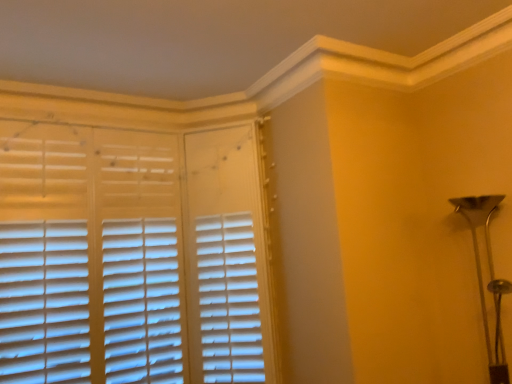
The image size is (512, 384). What are the coordinates of `metallic silver table lamp at right` in the screenshot? It's located at (490, 276).

The width and height of the screenshot is (512, 384). What do you see at coordinates (490, 276) in the screenshot?
I see `metallic silver table lamp at right` at bounding box center [490, 276].

Where is `metallic silver table lamp at right`? The height and width of the screenshot is (384, 512). metallic silver table lamp at right is located at coordinates (490, 276).